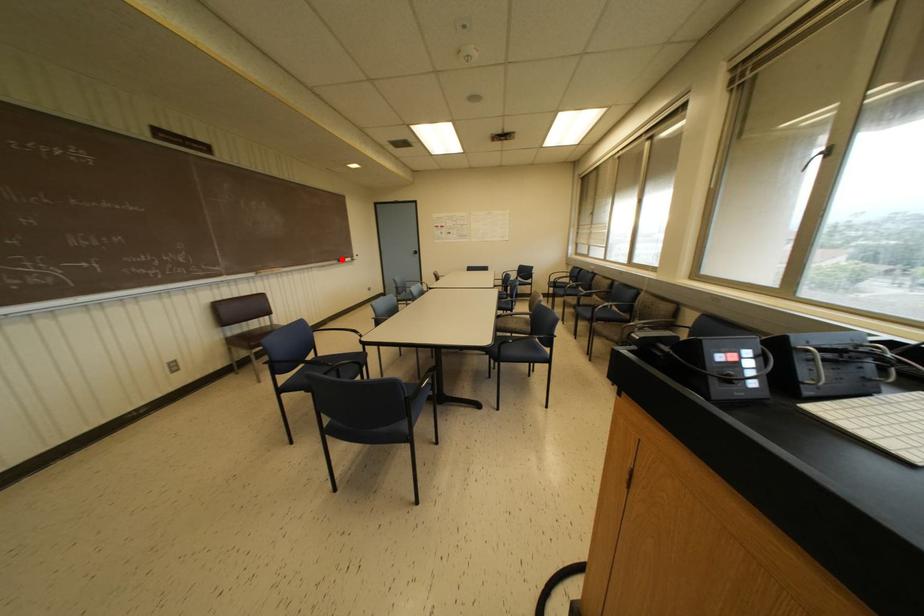
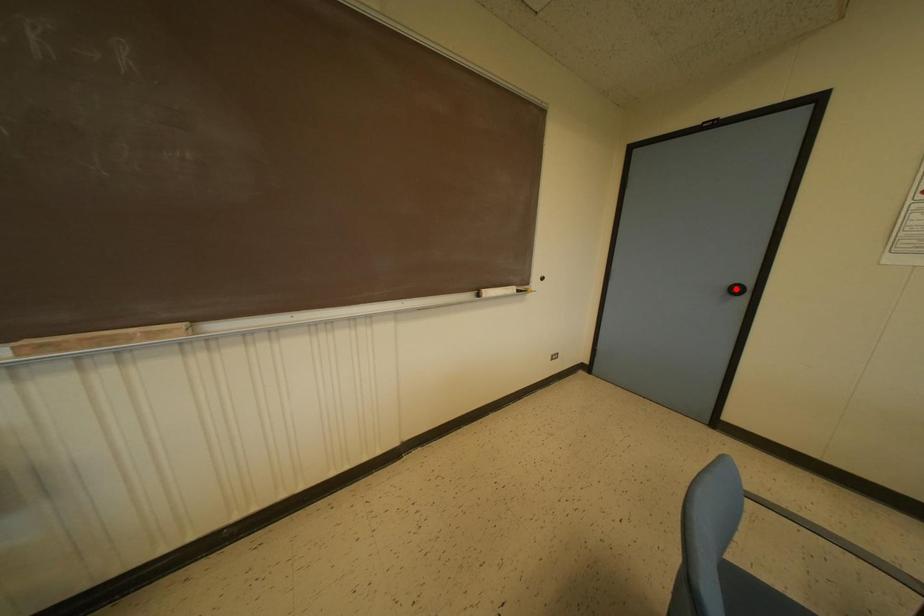
I am providing you with two images of the same scene from different viewpoints. A red point is marked on the first image and another point is marked on the second image. Is the red point in image1 aligned with the point shown in image2?

No